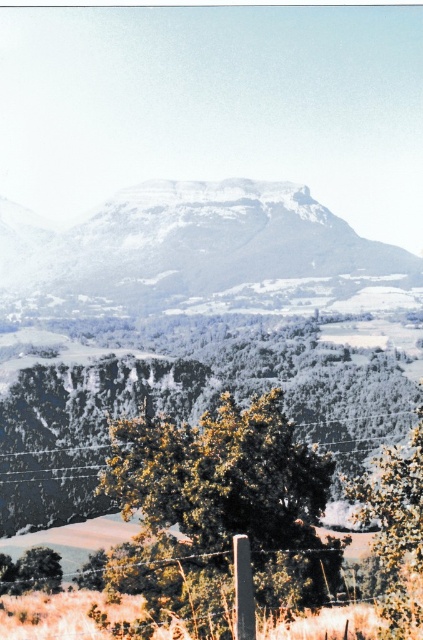
Does green leafy tree at center have a greater height compared to green matte tree at lower right?

Correct, green leafy tree at center is much taller as green matte tree at lower right.

Does point (282, 444) lie behind point (403, 552)?

Yes, point (282, 444) is behind point (403, 552).

At what (x,y) coordinates should I click in order to perform the action: click on green leafy tree at center. Please return your answer as a coordinate pair (x, y). Image resolution: width=423 pixels, height=640 pixels. Looking at the image, I should click on (219, 512).

Measure the distance from white snow-covered mountain at center to green matte tree at lower right.

They are 320.33 meters apart.

What do you see at coordinates (189, 243) in the screenshot?
I see `white snow-covered mountain at center` at bounding box center [189, 243].

Find the location of a particular element. Image resolution: width=423 pixels, height=640 pixels. white snow-covered mountain at center is located at coordinates (189, 243).

Identify the location of white snow-covered mountain at center. (189, 243).

Is green leafy tree at center smaller than white snow-covered mountain at center?

Indeed, green leafy tree at center has a smaller size compared to white snow-covered mountain at center.

Which is above, green leafy tree at center or white snow-covered mountain at center?

white snow-covered mountain at center is higher up.

Identify the location of green leafy tree at center. (219, 512).